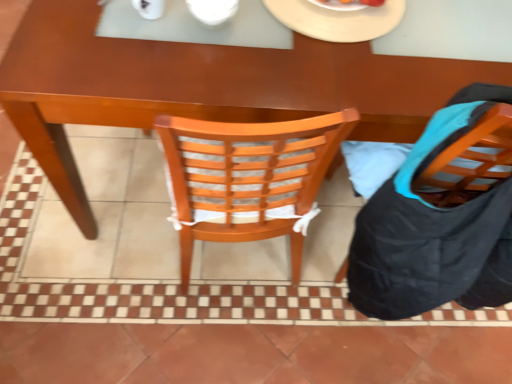
Where is `white glossy bowl at upper center`? The width and height of the screenshot is (512, 384). white glossy bowl at upper center is located at coordinates (212, 10).

Measure the distance between point (x=283, y=2) and camera.

They are 3.64 feet apart.

At what (x,y) coordinates should I click in order to perform the action: click on brown wooden desk at center. Please return your answer as a coordinate pair (x, y). This screenshot has width=512, height=384. Looking at the image, I should click on (204, 86).

Where is `white glossy bowl at upper center`? Image resolution: width=512 pixels, height=384 pixels. white glossy bowl at upper center is located at coordinates (212, 10).

Is white glossy bowl at upper center inside or outside of wooden chair at right?

white glossy bowl at upper center exists outside the volume of wooden chair at right.

Considering the sizes of objects white glossy bowl at upper center and wooden chair at right in the image provided, who is wider, white glossy bowl at upper center or wooden chair at right?

wooden chair at right is wider.

Measure the distance from white glossy bowl at upper center to wooden chair at right.

A distance of 24.75 inches exists between white glossy bowl at upper center and wooden chair at right.

Which is more to the right, white glossy bowl at upper center or wooden chair at right?

wooden chair at right.

Is wooden chair at right at the left side of white glossy bowl at upper center?

Incorrect, wooden chair at right is not on the left side of white glossy bowl at upper center.

From the image's perspective, is wooden chair at right positioned above or below white glossy bowl at upper center?

wooden chair at right is below white glossy bowl at upper center.

Is wooden chair at right not near white glossy bowl at upper center?

wooden chair at right is near white glossy bowl at upper center, not far away.

How distant is wooden chair at right from white glossy bowl at upper center?

They are 24.75 inches apart.

From the image's perspective, between white glossy bowl at upper center and brown wooden desk at center, which one is located above?

white glossy bowl at upper center, from the image's perspective.

Is white glossy bowl at upper center far from brown wooden desk at center?

No, there isn't a large distance between white glossy bowl at upper center and brown wooden desk at center.

At what (x,y) coordinates should I click in order to perform the action: click on tableware on the left of brown wooden desk at center. Please return your answer as a coordinate pair (x, y). Looking at the image, I should click on (212, 10).

Is white matte plate at upper center at the right side of wooden chair at right?

In fact, white matte plate at upper center is to the left of wooden chair at right.

From the image's perspective, which object appears higher, white matte plate at upper center or wooden chair at right?

From the image's view, white matte plate at upper center is above.

Can you confirm if white matte plate at upper center is taller than wooden chair at right?

In fact, white matte plate at upper center may be shorter than wooden chair at right.

Considering the sizes of objects white matte plate at upper center and wooden chair at right in the image provided, who is smaller, white matte plate at upper center or wooden chair at right?

white matte plate at upper center is smaller.

Is white glossy bowl at upper center not inside white matte plate at upper center?

white glossy bowl at upper center lies outside white matte plate at upper center's area.

Considering the sizes of objects white glossy bowl at upper center and white matte plate at upper center in the image provided, who is shorter, white glossy bowl at upper center or white matte plate at upper center?

With less height is white matte plate at upper center.

Identify the location of tableware that appears below the white matte plate at upper center (from the image's perspective). The height and width of the screenshot is (384, 512). (212, 10).

Is white glossy bowl at upper center thinner than white matte plate at upper center?

Yes.

Which of these two, white matte plate at upper center or brown wooden desk at center, is wider?

brown wooden desk at center is wider.

Would you consider white matte plate at upper center to be distant from brown wooden desk at center?

No.

Does white matte plate at upper center have a greater height compared to brown wooden desk at center?

In fact, white matte plate at upper center may be shorter than brown wooden desk at center.

Could you tell me if wooden chair at right is turned towards brown wooden desk at center?

Yes, wooden chair at right is turned towards brown wooden desk at center.

Considering the sizes of wooden chair at right and brown wooden desk at center in the image, is wooden chair at right taller or shorter than brown wooden desk at center?

wooden chair at right is taller than brown wooden desk at center.

Can you confirm if wooden chair at right is thinner than brown wooden desk at center?

Yes.

Does wooden chair at right lie behind brown wooden desk at center?

No.

This screenshot has height=384, width=512. Find the location of `chair in front of the white glossy bowl at upper center`. chair in front of the white glossy bowl at upper center is located at coordinates (473, 157).

Where is `chair below the white glossy bowl at upper center (from the image's perspective)`? The height and width of the screenshot is (384, 512). chair below the white glossy bowl at upper center (from the image's perspective) is located at coordinates (473, 157).

Estimate the real-world distances between objects in this image. Which object is further from brown wooden desk at center, white glossy bowl at upper center or white matte plate at upper center?

Based on the image, white glossy bowl at upper center appears to be further to brown wooden desk at center.

In the scene shown: Looking at the image, which one is located further to wooden chair at right, white glossy bowl at upper center or brown wooden desk at center?

white glossy bowl at upper center.

From the image, which object appears to be nearer to wooden chair at right, white matte plate at upper center or white glossy bowl at upper center?

white matte plate at upper center lies closer to wooden chair at right than the other object.

Which object lies further to the anchor point brown wooden desk at center, white matte plate at upper center or wooden chair at right?

wooden chair at right.

From the image, which object appears to be farther from white glossy bowl at upper center, brown wooden desk at center or white matte plate at upper center?

The object further to white glossy bowl at upper center is brown wooden desk at center.

When comparing their distances from wooden chair at right, does brown wooden desk at center or white matte plate at upper center seem further?

Based on the image, white matte plate at upper center appears to be further to wooden chair at right.

Looking at the image, which one is located closer to white matte plate at upper center, wooden chair at right or brown wooden desk at center?

brown wooden desk at center.

From the image, which object appears to be nearer to white matte plate at upper center, white glossy bowl at upper center or wooden chair at right?

The object closer to white matte plate at upper center is white glossy bowl at upper center.

The height and width of the screenshot is (384, 512). In order to click on desk between white matte plate at upper center and wooden chair at right in the up-down direction in this screenshot , I will do `click(204, 86)`.

You are a GUI agent. You are given a task and a screenshot of the screen. Output one action in this format:
    pyautogui.click(x=<x>, y=<y>)
    Task: Click on the plate between white glossy bowl at upper center and wooden chair at right
    The image size is (512, 384).
    Given the screenshot: What is the action you would take?
    [339, 18]

Find the location of a particular element. This screenshot has width=512, height=384. desk between white glossy bowl at upper center and wooden chair at right from left to right is located at coordinates (204, 86).

This screenshot has width=512, height=384. Find the location of `desk located between white glossy bowl at upper center and white matte plate at upper center in the left-right direction`. desk located between white glossy bowl at upper center and white matte plate at upper center in the left-right direction is located at coordinates (204, 86).